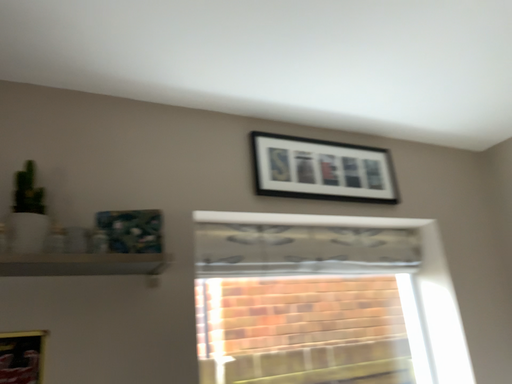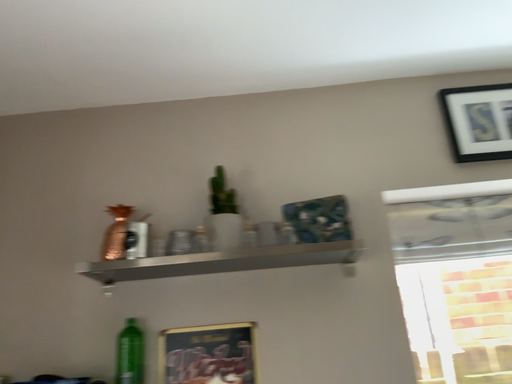
Question: Which way did the camera rotate in the video?

Choices:
 (A) rotated left
 (B) rotated right

Answer: (A)